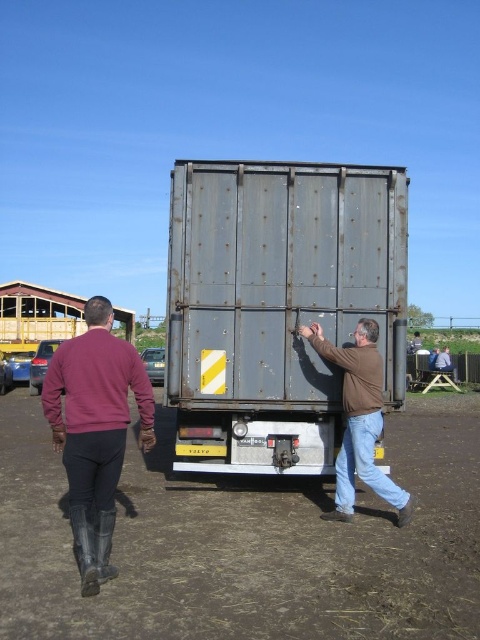
Can you confirm if rusty metal trailer truck at center is positioned below dark red sweater at left?

No.

Consider the image. Is rusty metal trailer truck at center above dark red sweater at left?

Yes, rusty metal trailer truck at center is above dark red sweater at left.

Does point (300, 413) come farther from viewer compared to point (57, 392)?

That is True.

This screenshot has width=480, height=640. In order to click on rusty metal trailer truck at center in this screenshot , I will do `click(276, 305)`.

Between rusty metal trailer truck at center and brown matte jacket at center, which one is positioned lower?

brown matte jacket at center is lower down.

Does rusty metal trailer truck at center appear under brown matte jacket at center?

Incorrect, rusty metal trailer truck at center is not positioned below brown matte jacket at center.

Between point (292, 353) and point (362, 390), which one is positioned behind?

The point (292, 353) is more distant.

Locate an element on the screen. Image resolution: width=480 pixels, height=640 pixels. rusty metal trailer truck at center is located at coordinates (276, 305).

Can you confirm if brown dirt field at center is bigger than rusty metal trailer truck at center?

Correct, brown dirt field at center is larger in size than rusty metal trailer truck at center.

Is point (235, 611) farther from viewer compared to point (224, 410)?

No, it is not.

Locate an element on the screen. brown dirt field at center is located at coordinates (248, 541).